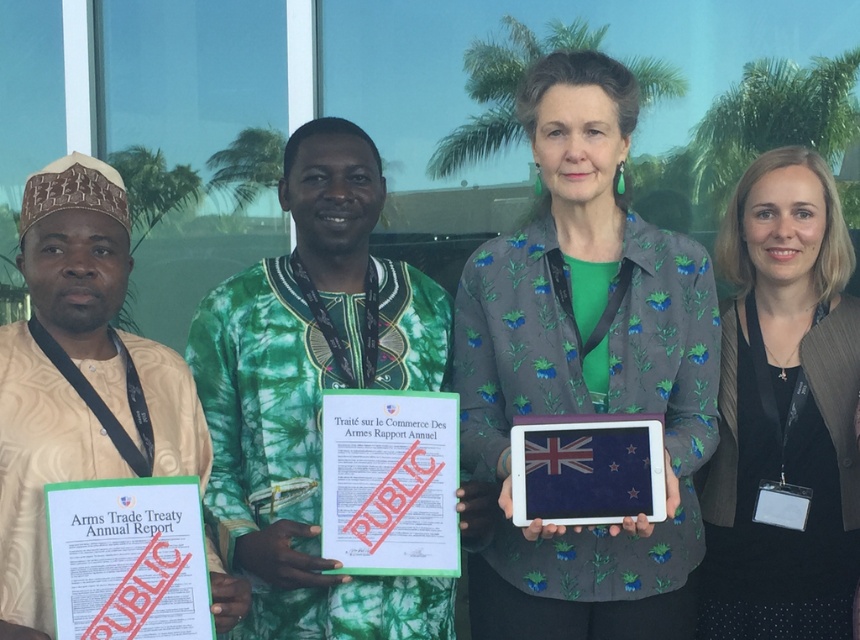
Question: Which point is farther from the camera taking this photo?

Choices:
 (A) (329, 435)
 (B) (796, 266)
 (C) (670, 484)

Answer: (B)

Question: Which of the following is the closest to the observer?

Choices:
 (A) (839, 497)
 (B) (624, 445)
 (C) (329, 497)
 (D) (496, 292)

Answer: (B)

Question: Is green floral jacket at center positioned behind blue fabric tablet at center?

Choices:
 (A) yes
 (B) no

Answer: (A)

Question: Considering the real-world distances, which object is closest to the black matte jacket at right?

Choices:
 (A) blue fabric tablet at center
 (B) green paper document at lower left

Answer: (A)

Question: Does black matte jacket at right come behind green paper document at center?

Choices:
 (A) no
 (B) yes

Answer: (B)

Question: Where is green paper document at center located in relation to blue fabric tablet at center in the image?

Choices:
 (A) left
 (B) right

Answer: (A)